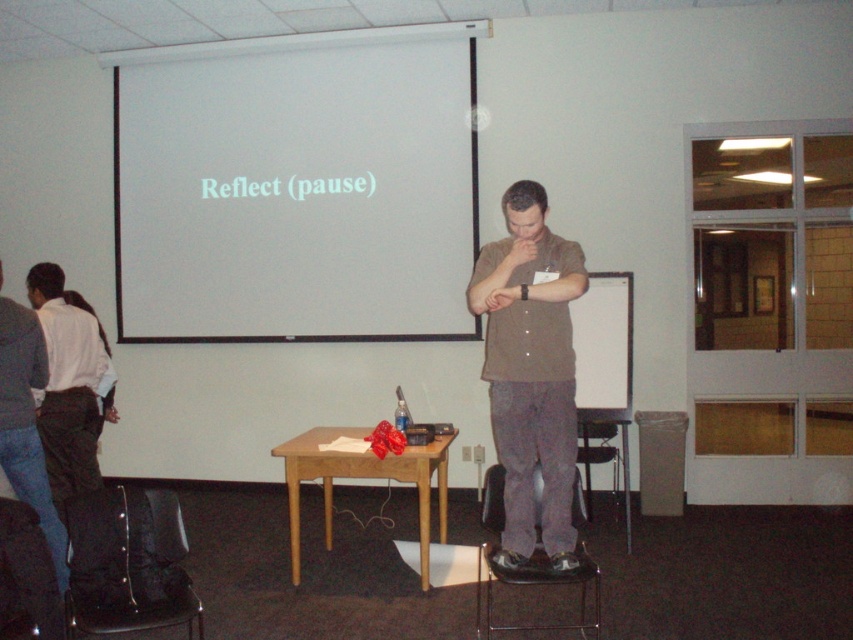
Which is more to the right, white matte projection screen at upper center or brown cotton shirt at center?

brown cotton shirt at center

Which is more to the left, white matte projection screen at upper center or brown cotton shirt at center?

From the viewer's perspective, white matte projection screen at upper center appears more on the left side.

Where is `white matte projection screen at upper center`? white matte projection screen at upper center is located at coordinates (296, 195).

Where is `white matte projection screen at upper center`? This screenshot has height=640, width=853. white matte projection screen at upper center is located at coordinates tap(296, 195).

Between white matte projection screen at upper center and brown wooden table at center, which one appears on the right side from the viewer's perspective?

From the viewer's perspective, brown wooden table at center appears more on the right side.

Is point (270, 310) closer to camera compared to point (374, 467)?

No, (270, 310) is behind (374, 467).

Is point (238, 202) closer to viewer compared to point (354, 476)?

No, (238, 202) is further to viewer.

Locate an element on the screen. This screenshot has height=640, width=853. white matte projection screen at upper center is located at coordinates (296, 195).

Can you confirm if brown cotton shirt at center is bigger than brown wooden table at center?

No.

Measure the distance between point (550, 396) and camera.

Point (550, 396) is 10.35 feet from camera.

Describe the element at coordinates (531, 371) in the screenshot. The width and height of the screenshot is (853, 640). I see `brown cotton shirt at center` at that location.

Identify the location of brown cotton shirt at center. (531, 371).